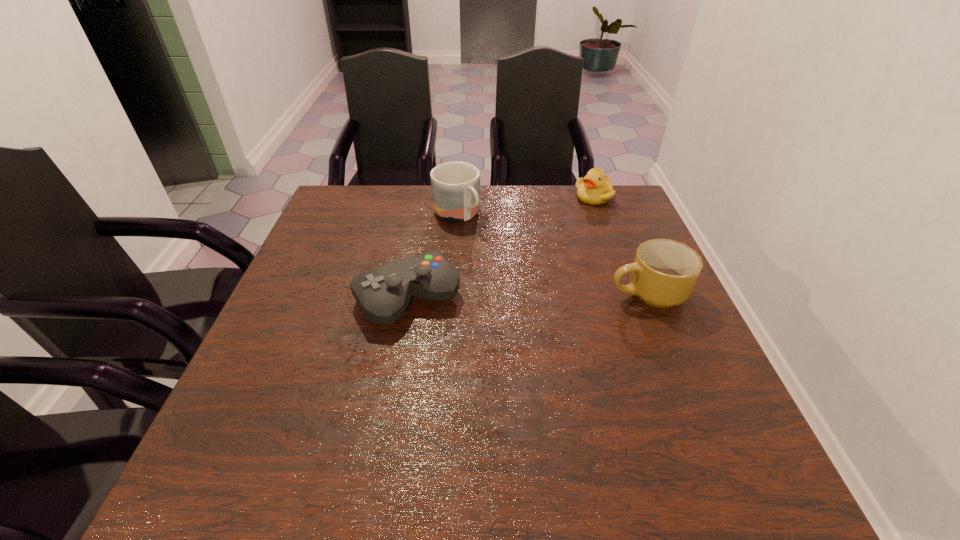
Where is `object located in the far right corner section of the desktop`? The height and width of the screenshot is (540, 960). object located in the far right corner section of the desktop is located at coordinates 595,188.

Find the location of `vacant area at the far edge`. vacant area at the far edge is located at coordinates (544, 204).

This screenshot has height=540, width=960. I want to click on vacant space at the near edge of the desktop, so click(x=587, y=405).

What are the coordinates of `vacant space at the left edge of the desktop` in the screenshot? It's located at (310, 275).

The height and width of the screenshot is (540, 960). Identify the location of free spot at the right edge of the desktop. (651, 355).

This screenshot has height=540, width=960. In the image, there is a desktop. In order to click on vacant region at the far left corner in this screenshot , I will do `click(365, 215)`.

Locate an element on the screen. The image size is (960, 540). free space at the far right corner of the desktop is located at coordinates (621, 195).

This screenshot has width=960, height=540. In order to click on blank region between the duckling and the nearer mug in this screenshot , I will do `click(620, 245)`.

This screenshot has width=960, height=540. Find the location of `vacant space that's between the farther mug and the shorter mug`. vacant space that's between the farther mug and the shorter mug is located at coordinates (552, 254).

Locate an element on the screen. The height and width of the screenshot is (540, 960). vacant point located between the duckling and the control is located at coordinates (501, 247).